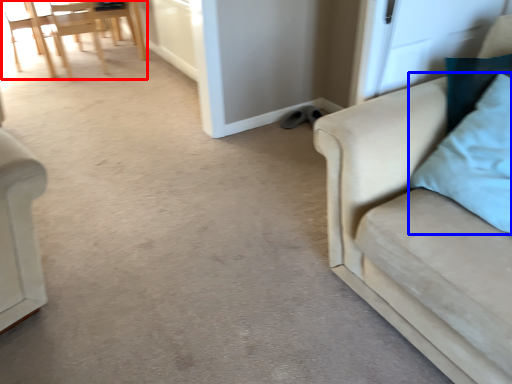
Question: Which object appears closest to the camera in this image, chair (highlighted by a red box) or pillow (highlighted by a blue box)?

Choices:
 (A) chair
 (B) pillow

Answer: (B)